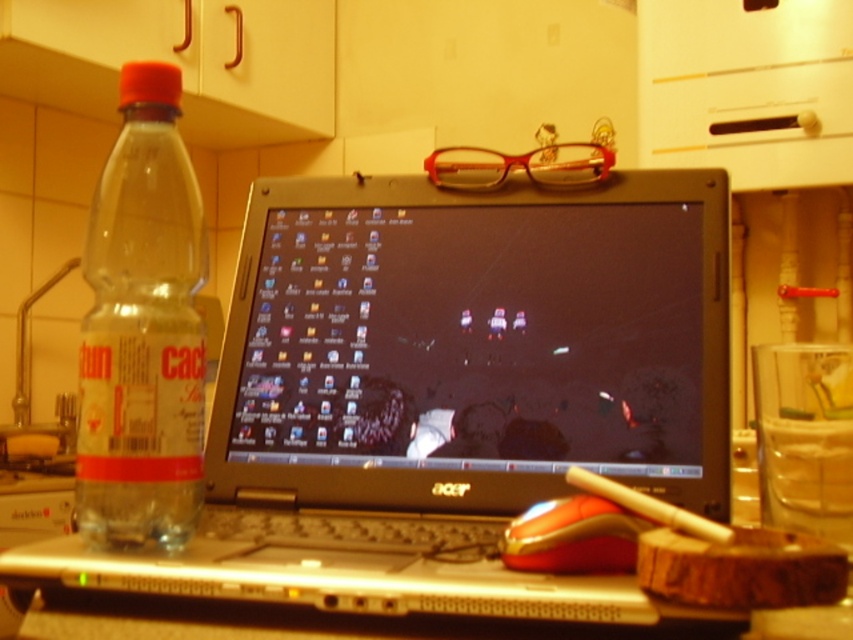
Can you confirm if clear plastic bottle at left is wider than orange matte mouse at lower center?

Indeed, clear plastic bottle at left has a greater width compared to orange matte mouse at lower center.

Looking at this image, is clear plastic bottle at left thinner than orange matte mouse at lower center?

No.

Between point (126, 266) and point (566, 541), which one is positioned in front?

Point (566, 541) is more forward.

This screenshot has height=640, width=853. In order to click on clear plastic bottle at left in this screenshot , I will do `click(142, 328)`.

Between metallic silver laptop at center and clear plastic bottle at left, which one is positioned lower?

metallic silver laptop at center is lower down.

Which of these two, metallic silver laptop at center or clear plastic bottle at left, stands shorter?

With less height is metallic silver laptop at center.

At what (x,y) coordinates should I click in order to perform the action: click on metallic silver laptop at center. Please return your answer as a coordinate pair (x, y). The height and width of the screenshot is (640, 853). Looking at the image, I should click on (445, 392).

Who is more forward, (489, 541) or (461, 147)?

Point (489, 541) is more forward.

Is metallic silver laptop at center shorter than translucent orange plastic glasses at upper center?

No, metallic silver laptop at center is not shorter than translucent orange plastic glasses at upper center.

Describe the element at coordinates (445, 392) in the screenshot. I see `metallic silver laptop at center` at that location.

Where is `metallic silver laptop at center`? The image size is (853, 640). metallic silver laptop at center is located at coordinates (445, 392).